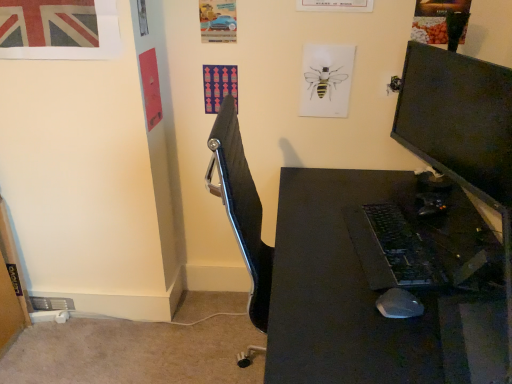
Question: Can you confirm if black plastic mouse at lower right is positioned to the right of black glossy monitor at right?

Choices:
 (A) yes
 (B) no

Answer: (B)

Question: Would you consider black plastic mouse at lower right to be distant from black glossy monitor at right?

Choices:
 (A) no
 (B) yes

Answer: (A)

Question: Is black plastic mouse at lower right in front of black glossy monitor at right?

Choices:
 (A) yes
 (B) no

Answer: (B)

Question: From a real-world perspective, is black plastic mouse at lower right under black glossy monitor at right?

Choices:
 (A) yes
 (B) no

Answer: (A)

Question: From a real-world perspective, is black plastic mouse at lower right positioned over black glossy monitor at right based on gravity?

Choices:
 (A) yes
 (B) no

Answer: (B)

Question: Does black plastic mouse at lower right have a greater height compared to black glossy monitor at right?

Choices:
 (A) no
 (B) yes

Answer: (A)

Question: Is black plastic desk at center in front of black plastic mouse at lower right?

Choices:
 (A) yes
 (B) no

Answer: (A)

Question: Is black plastic desk at center to the right of black plastic mouse at lower right from the viewer's perspective?

Choices:
 (A) yes
 (B) no

Answer: (A)

Question: From the image's perspective, does black plastic desk at center appear lower than black plastic mouse at lower right?

Choices:
 (A) yes
 (B) no

Answer: (A)

Question: Are black plastic desk at center and black plastic mouse at lower right beside each other?

Choices:
 (A) yes
 (B) no

Answer: (B)

Question: Does black plastic desk at center have a lesser height compared to black plastic mouse at lower right?

Choices:
 (A) yes
 (B) no

Answer: (B)

Question: Is black plastic mouse at lower right completely or partially inside black plastic desk at center?

Choices:
 (A) no
 (B) yes

Answer: (B)

Question: Does union jack paper at upper left, marked as the 1th poster page in a left-to-right arrangement, come behind black plastic keyboard at center-right?

Choices:
 (A) yes
 (B) no

Answer: (A)